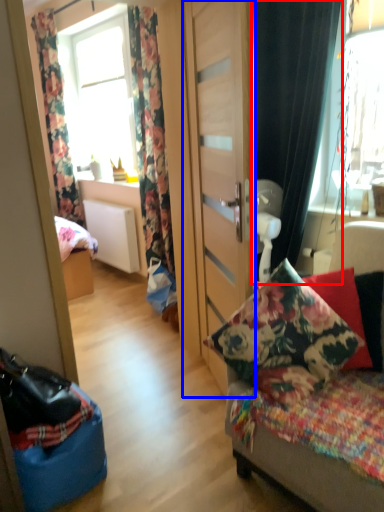
Question: Which point is further to the camera, curtain (highlighted by a red box) or door (highlighted by a blue box)?

Choices:
 (A) curtain
 (B) door

Answer: (A)